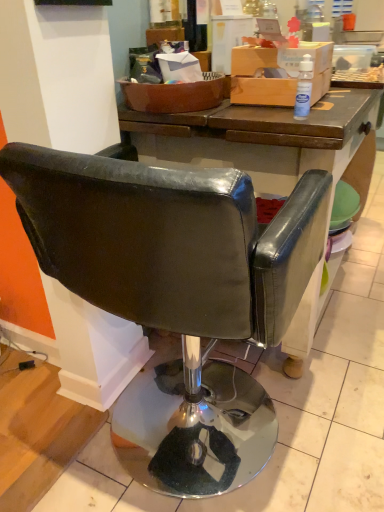
What do you see at coordinates (304, 88) in the screenshot? I see `transparent plastic bottle at upper right` at bounding box center [304, 88].

At what (x,y) coordinates should I click in order to perform the action: click on transparent plastic bottle at upper right. Please return your answer as a coordinate pair (x, y). This screenshot has height=512, width=384. Looking at the image, I should click on (304, 88).

This screenshot has width=384, height=512. Describe the element at coordinates (177, 295) in the screenshot. I see `leather-like black chair at center` at that location.

Image resolution: width=384 pixels, height=512 pixels. I want to click on leather-like black chair at center, so click(177, 295).

Where is `transparent plastic bottle at upper right`? Image resolution: width=384 pixels, height=512 pixels. transparent plastic bottle at upper right is located at coordinates (304, 88).

Based on the photo, which is more to the left, transparent plastic bottle at upper right or leather-like black chair at center?

leather-like black chair at center is more to the left.

Does transparent plastic bottle at upper right lie in front of leather-like black chair at center?

No, transparent plastic bottle at upper right is behind leather-like black chair at center.

Is point (296, 98) closer or farther from the camera than point (274, 294)?

Point (296, 98) is positioned farther from the camera compared to point (274, 294).

From the image's perspective, is transparent plastic bottle at upper right over leather-like black chair at center?

Yes, from the image's perspective, transparent plastic bottle at upper right is above leather-like black chair at center.

From a real-world perspective, is transparent plastic bottle at upper right physically located above or below leather-like black chair at center?

transparent plastic bottle at upper right is situated higher than leather-like black chair at center in the real world.

Can you confirm if transparent plastic bottle at upper right is wider than leather-like black chair at center?

No.

Consider the image. Who is shorter, transparent plastic bottle at upper right or leather-like black chair at center?

transparent plastic bottle at upper right.

Who is smaller, transparent plastic bottle at upper right or leather-like black chair at center?

transparent plastic bottle at upper right is smaller.

Is transparent plastic bottle at upper right outside of leather-like black chair at center?

Indeed, transparent plastic bottle at upper right is completely outside leather-like black chair at center.

Can you see transparent plastic bottle at upper right touching leather-like black chair at center?

They are not placed beside each other.

Is transparent plastic bottle at upper right looking in the opposite direction of leather-like black chair at center?

No, transparent plastic bottle at upper right is not facing the opposite direction of leather-like black chair at center.

Can you tell me how much transparent plastic bottle at upper right and leather-like black chair at center differ in facing direction?

The angle between the facing direction of transparent plastic bottle at upper right and the facing direction of leather-like black chair at center is 0.00212 degrees.

You are a GUI agent. You are given a task and a screenshot of the screen. Output one action in this format:
    pyautogui.click(x=<x>, y=<y>)
    Task: Click on the bottle on the right of leather-like black chair at center
    The height and width of the screenshot is (512, 384).
    Given the screenshot: What is the action you would take?
    pyautogui.click(x=304, y=88)

Which object is positioned more to the left, leather-like black chair at center or transparent plastic bottle at upper right?

From the viewer's perspective, leather-like black chair at center appears more on the left side.

Which object is closer to the camera, leather-like black chair at center or transparent plastic bottle at upper right?

leather-like black chair at center is closer to the camera.

Considering the positions of point (132, 444) and point (305, 78), is point (132, 444) closer or farther from the camera than point (305, 78)?

Point (132, 444).

From the image's perspective, would you say leather-like black chair at center is positioned over transparent plastic bottle at upper right?

Incorrect, from the image's perspective, leather-like black chair at center is lower than transparent plastic bottle at upper right.

From a real-world perspective, relative to transparent plastic bottle at upper right, is leather-like black chair at center vertically above or below?

Clearly, from a real-world perspective, leather-like black chair at center is below transparent plastic bottle at upper right.

Can you confirm if leather-like black chair at center is wider than transparent plastic bottle at upper right?

Correct, the width of leather-like black chair at center exceeds that of transparent plastic bottle at upper right.

In terms of height, does leather-like black chair at center look taller or shorter compared to transparent plastic bottle at upper right?

In the image, leather-like black chair at center appears to be taller than transparent plastic bottle at upper right.

Considering the sizes of objects leather-like black chair at center and transparent plastic bottle at upper right in the image provided, who is smaller, leather-like black chair at center or transparent plastic bottle at upper right?

transparent plastic bottle at upper right is smaller.

Could transparent plastic bottle at upper right be considered to be inside leather-like black chair at center?

No.

Would you consider leather-like black chair at center to be distant from transparent plastic bottle at upper right?

No, leather-like black chair at center is in close proximity to transparent plastic bottle at upper right.

Is leather-like black chair at center facing away from transparent plastic bottle at upper right?

No.

How many degrees apart are the facing directions of leather-like black chair at center and transparent plastic bottle at upper right?

leather-like black chair at center and transparent plastic bottle at upper right are facing 0.00212 degrees away from each other.

Locate an element on the screen. The image size is (384, 512). bottle above the leather-like black chair at center (from the image's perspective) is located at coordinates (304, 88).

Find the location of a particular element. This screenshot has width=384, height=512. bottle on the right of the leather-like black chair at center is located at coordinates (304, 88).

This screenshot has width=384, height=512. What are the coordinates of `chair below the transparent plastic bottle at upper right (from a real-world perspective)` in the screenshot? It's located at (177, 295).